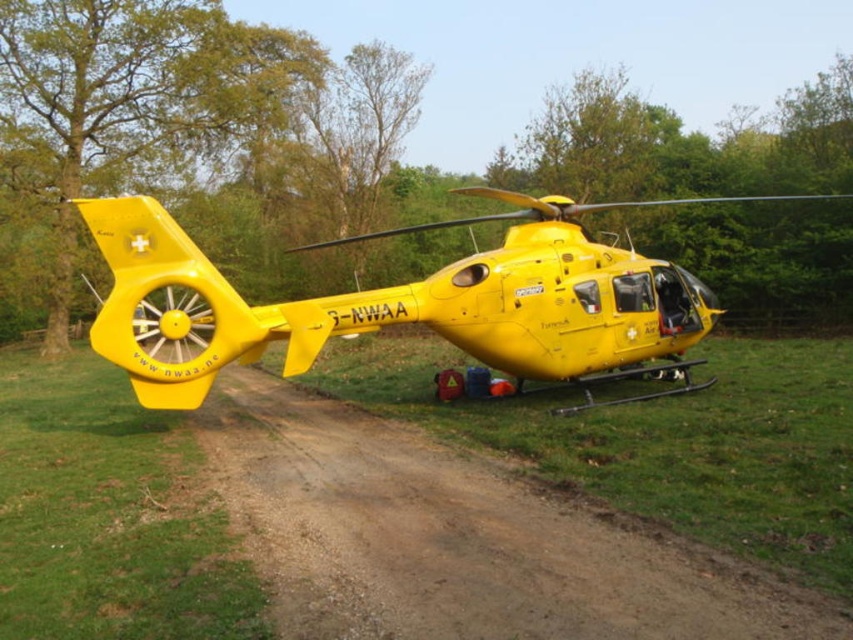
Which is behind, point (583, 540) or point (462, 298)?

Point (462, 298)

Can you confirm if brown dirt track at center is positioned above yellow matte helicopter at center?

No, brown dirt track at center is not above yellow matte helicopter at center.

Does point (515, 538) lie behind point (561, 349)?

That is False.

Find the location of a particular element. brown dirt track at center is located at coordinates (456, 538).